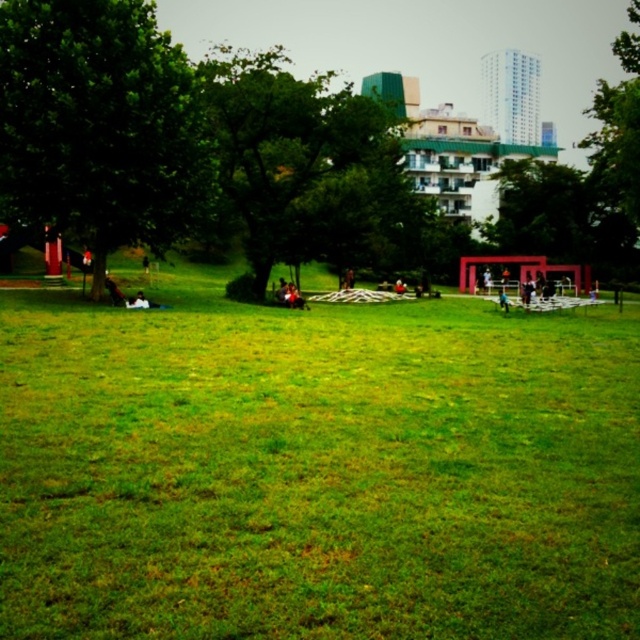
You are standing in the park and see the green leafy tree at right and the smooth black shirt at center. Which object is positioned more to the east?

The green leafy tree at right is positioned more to the east because it is to the right of the smooth black shirt at center, and in the scene, right corresponds to east.

Consider the image. You are standing at the center of the park and want to find the green leafy tree at right. According to the coordinates provided, in which direction should you look to see it?

The green leafy tree at right is located at point 0.248 on the x and 0.964 on the y. Since the coordinates are relative to the image, with 0 being the bottom left corner and 1 the top right corner, the tree is positioned to the left and near the top of the image. Therefore, you should look to your left and upwards to see the green leafy tree at right.